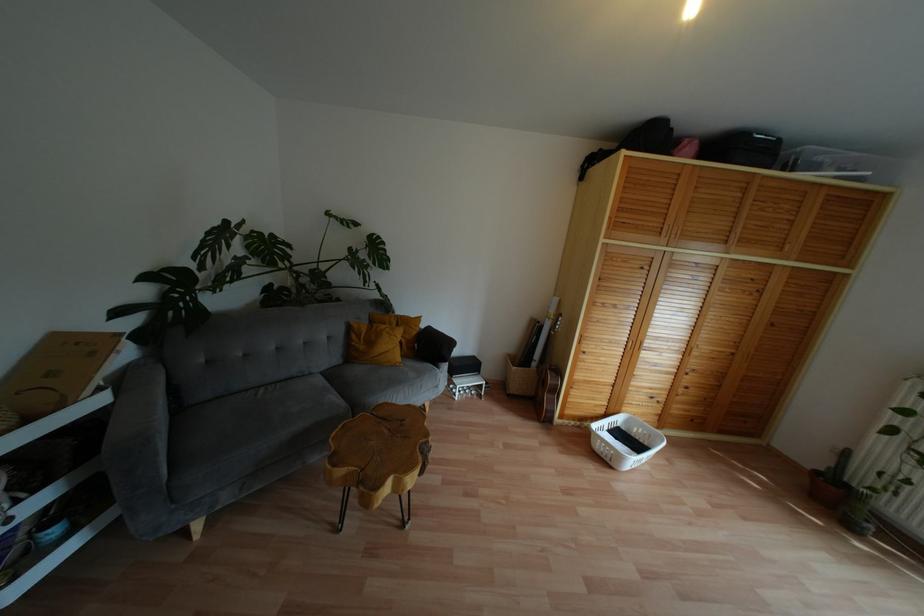
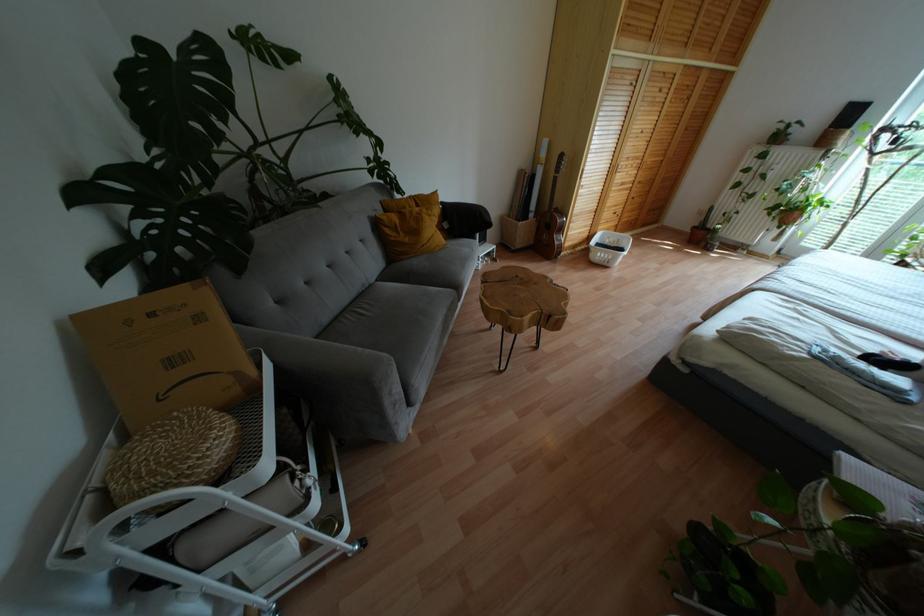
In the second image, find the point that corresponds to point (310, 373) in the first image.

(370, 284)